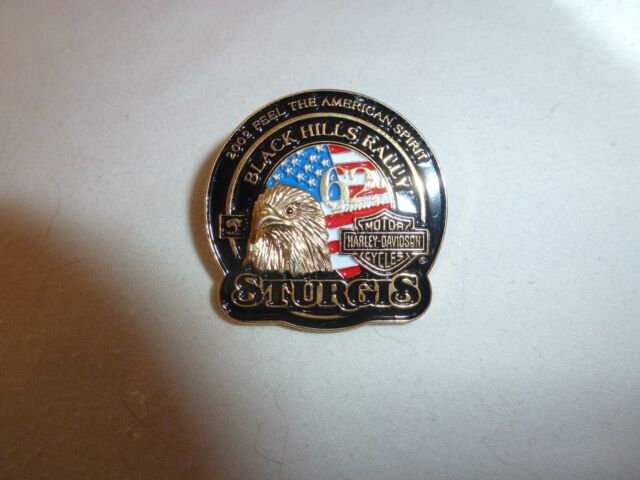
The width and height of the screenshot is (640, 480). Identify the location of white table. [466, 120].